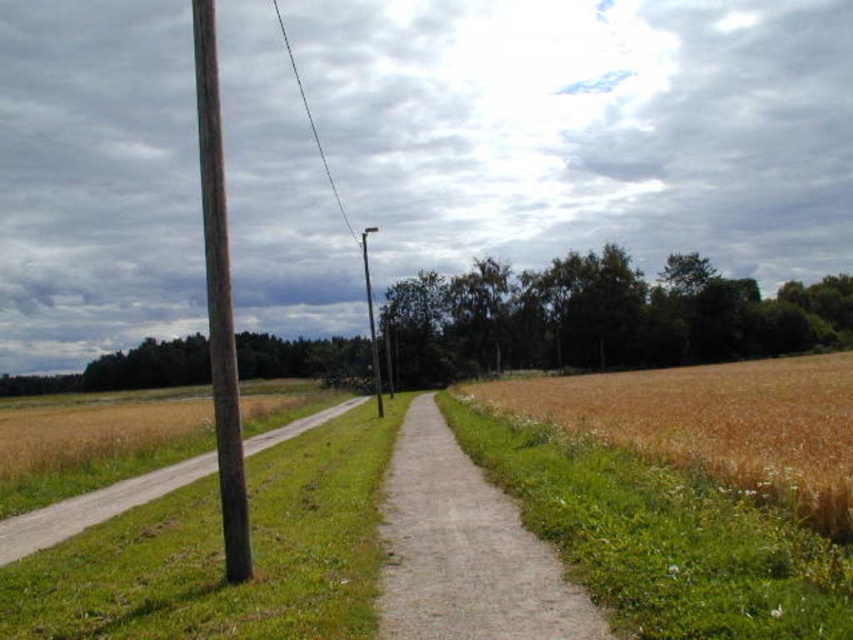
You are a farmer checking the growth of your crops. You notice the brown grassy wheat field at right and the black wire at upper center. Which one is taller?

The black wire at upper center is taller than the brown grassy wheat field at right.

You are standing at the bottom left corner of the image and want to reach the brown grassy wheat field at right. Which direction should you walk to get there?

The brown grassy wheat field at right is located at point (715, 422), so you should walk towards the upper right direction to reach it.

You are a farmer standing at the bottom left of the image. You need to walk to the brown grassy wheat field at right to check its condition. Is the path from the bottom left to the field blocked by the brown dirt path at left?

The brown grassy wheat field at right is above the brown dirt path at left, so the path from the bottom left to the field is not blocked by the brown dirt path at left. You can walk along the path towards the center and then proceed to the field.